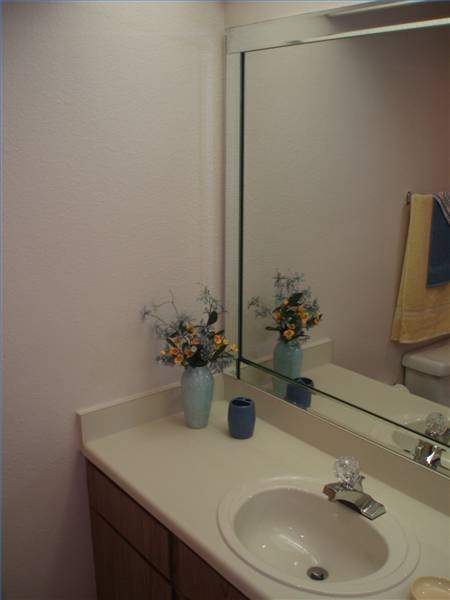
Locate an element on the screen. reflection of towel is located at coordinates (412, 294).